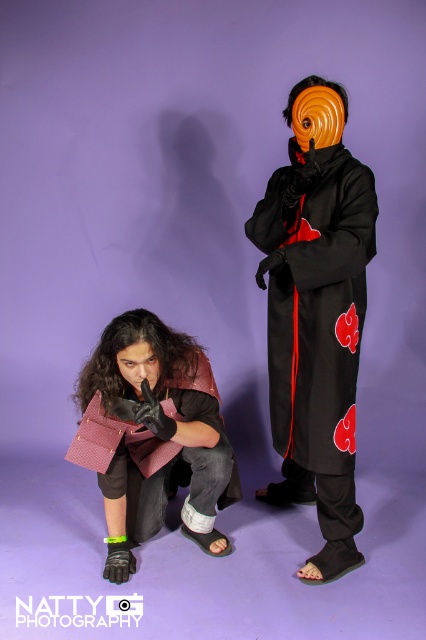
Can you confirm if black matte/soft fabric at center is positioned to the right of leather-like burgundy purse at lower left?

Indeed, black matte/soft fabric at center is positioned on the right side of leather-like burgundy purse at lower left.

How far apart are black matte/soft fabric at center and leather-like burgundy purse at lower left?

15.48 inches

Is point (328, 442) farther from camera compared to point (210, 465)?

Yes, it is behind point (210, 465).

Find the location of a particular element. The width and height of the screenshot is (426, 640). black matte/soft fabric at center is located at coordinates (316, 316).